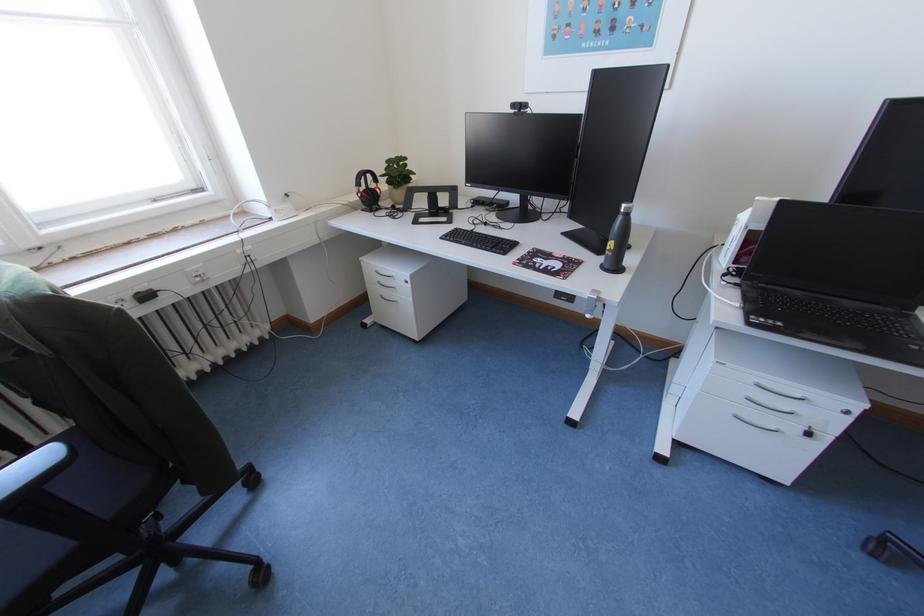
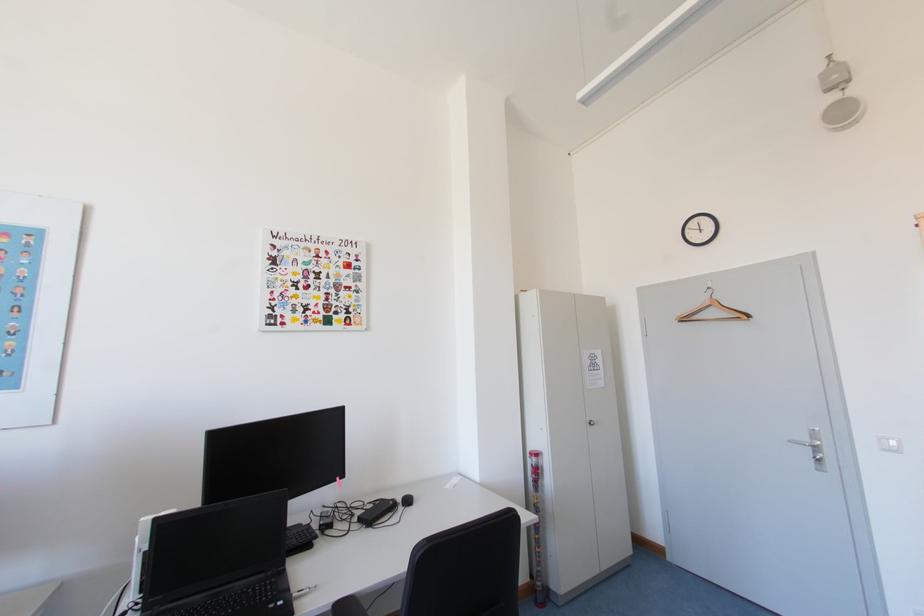
The first image is from the beginning of the video and the second image is from the end. How did the camera likely rotate when shooting the video?

The camera's rotation is toward right-up.